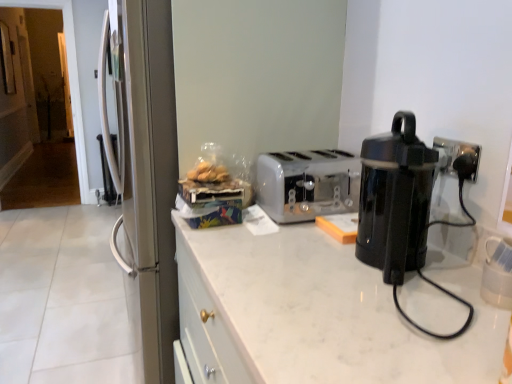
Question: Considering the relative sizes of white marble countertop at center and black plastic coffee pot at right in the image provided, is white marble countertop at center wider than black plastic coffee pot at right?

Choices:
 (A) yes
 (B) no

Answer: (A)

Question: Can you confirm if white marble countertop at center is thinner than black plastic coffee pot at right?

Choices:
 (A) yes
 (B) no

Answer: (B)

Question: Is white marble countertop at center taller than black plastic coffee pot at right?

Choices:
 (A) yes
 (B) no

Answer: (A)

Question: Is white marble countertop at center next to black plastic coffee pot at right?

Choices:
 (A) yes
 (B) no

Answer: (B)

Question: Is white marble countertop at center facing towards black plastic coffee pot at right?

Choices:
 (A) yes
 (B) no

Answer: (B)

Question: Does white marble countertop at center appear on the right side of black plastic coffee pot at right?

Choices:
 (A) yes
 (B) no

Answer: (B)

Question: Is black plastic coffee pot at right directly adjacent to white plastic toaster at center?

Choices:
 (A) yes
 (B) no

Answer: (B)

Question: Does black plastic coffee pot at right have a lesser width compared to white plastic toaster at center?

Choices:
 (A) yes
 (B) no

Answer: (A)

Question: Would you say black plastic coffee pot at right contains white plastic toaster at center?

Choices:
 (A) yes
 (B) no

Answer: (B)

Question: Is black plastic coffee pot at right aimed at white plastic toaster at center?

Choices:
 (A) no
 (B) yes

Answer: (A)

Question: Is black plastic coffee pot at right to the right of white plastic toaster at center from the viewer's perspective?

Choices:
 (A) yes
 (B) no

Answer: (A)

Question: Does black plastic coffee pot at right have a greater width compared to white plastic toaster at center?

Choices:
 (A) no
 (B) yes

Answer: (A)

Question: Is black plastic coffee pot at right a part of white plastic toaster at center?

Choices:
 (A) yes
 (B) no

Answer: (B)